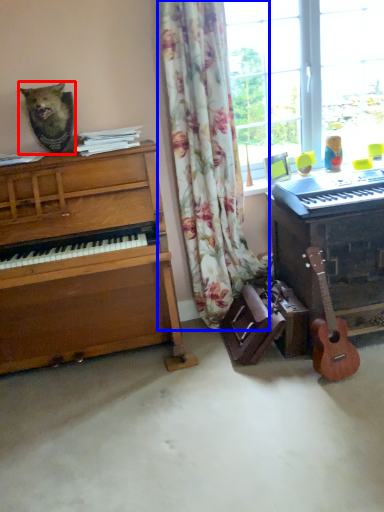
Question: Which object is further to the camera taking this photo, animal (highlighted by a red box) or curtain (highlighted by a blue box)?

Choices:
 (A) animal
 (B) curtain

Answer: (A)